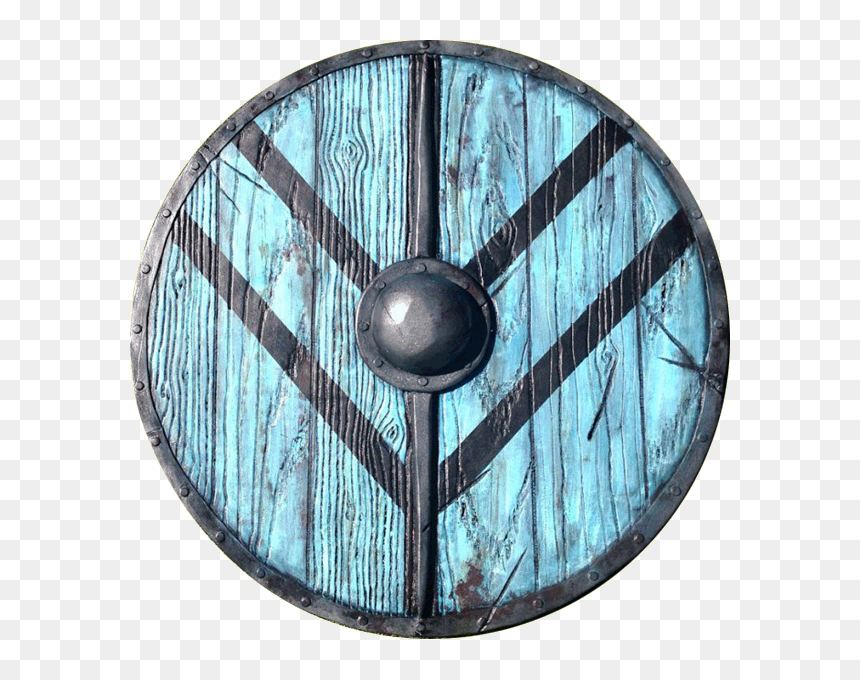
This screenshot has height=680, width=860. In order to click on blue paint in this screenshot , I will do `click(272, 490)`, `click(310, 279)`, `click(347, 162)`, `click(526, 152)`, `click(574, 243)`, `click(569, 452)`.